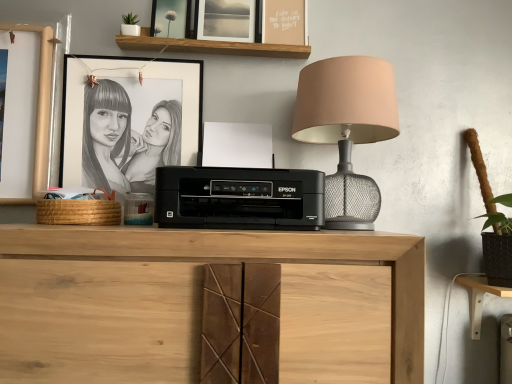
Question: Considering their positions, is light wood computer desk at lower right located in front of or behind matte glass picture frame at upper center, acting as the second picture frame starting from the top?

Choices:
 (A) front
 (B) behind

Answer: (A)

Question: From the image's perspective, is light wood computer desk at lower right above or below matte glass picture frame at upper center, which is counted as the 2th picture frame, starting from the bottom?

Choices:
 (A) below
 (B) above

Answer: (A)

Question: Estimate the real-world distances between objects in this image. Which object is closer to the matte gray lampshade at upper right?

Choices:
 (A) brown woven basket at left
 (B) light wood computer desk at lower right
 (C) black paper picture frame at upper left, the 1th picture frame ordered from the bottom
 (D) wooden at upper center
 (E) black plastic printer at center

Answer: (E)

Question: Estimate the real-world distances between objects in this image. Which object is farther from the brown woven basket at left?

Choices:
 (A) natural wood cabinet at center
 (B) matte glass picture frame at upper center, acting as the second picture frame starting from the top
 (C) white matte picture frame at upper center, acting as the third picture frame starting from the bottom
 (D) wooden at upper center
 (E) black paper picture frame at upper left, the third picture frame when ordered from top to bottom

Answer: (C)